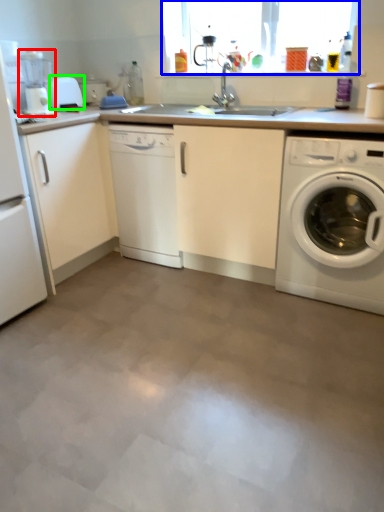
Question: Which is farther away from coffee machine (highlighted by a red box)? window screen (highlighted by a blue box) or appliance (highlighted by a green box)?

Choices:
 (A) window screen
 (B) appliance

Answer: (A)